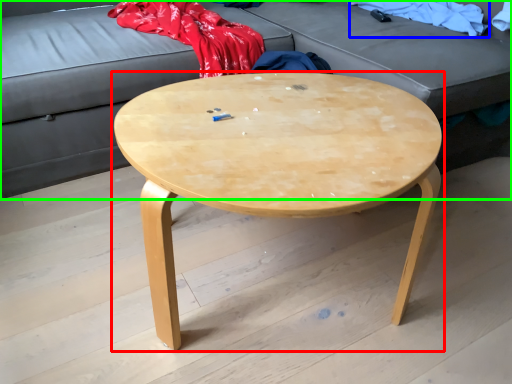
Question: Based on their relative distances, which object is farther from coffee table (highlighted by a red box)? Choose from clothing (highlighted by a blue box) and studio couch (highlighted by a green box).

Choices:
 (A) clothing
 (B) studio couch

Answer: (A)